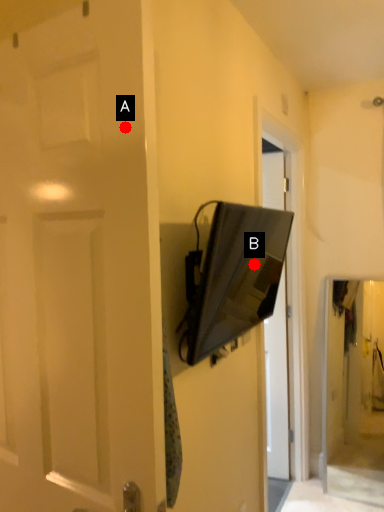
Question: Two points are circled on the image, labeled by A and B beside each circle. Which point is further to the camera?

Choices:
 (A) A is further
 (B) B is further

Answer: (B)